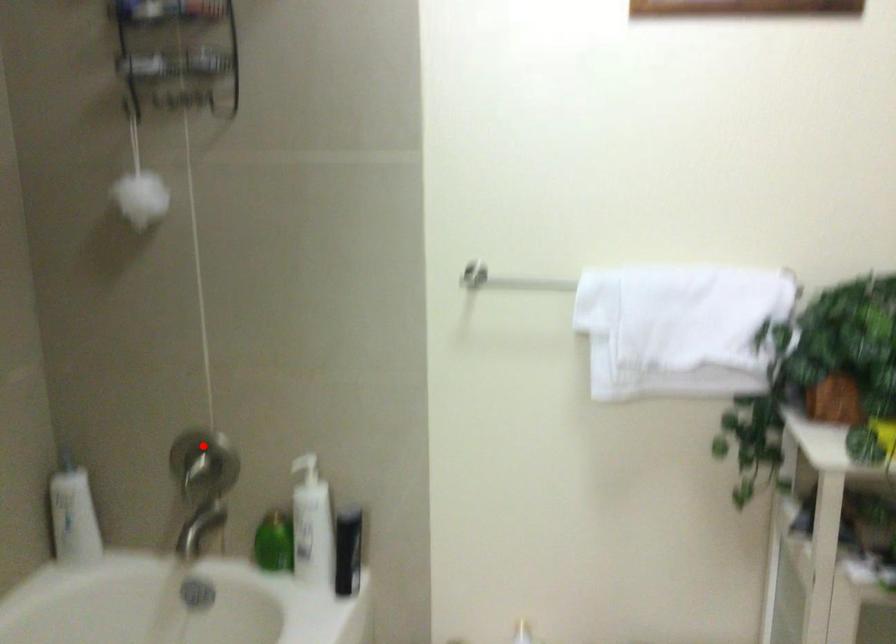
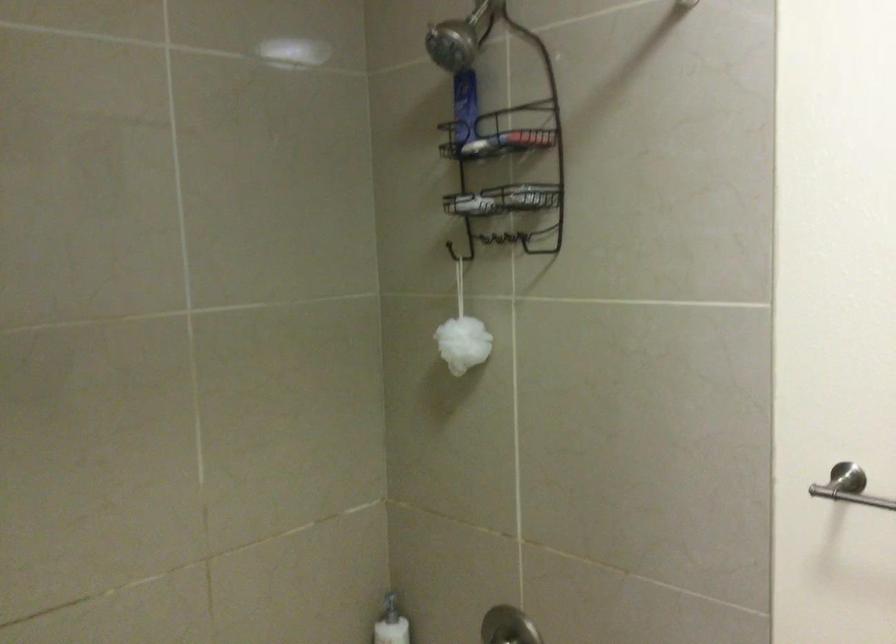
Question: A red point is marked in image1. In image2, is the corresponding 3D point closer to the camera or farther? Reply with the corresponding letter.

Choices:
 (A) The corresponding 3D point is closer.
 (B) The corresponding 3D point is farther.

Answer: (A)